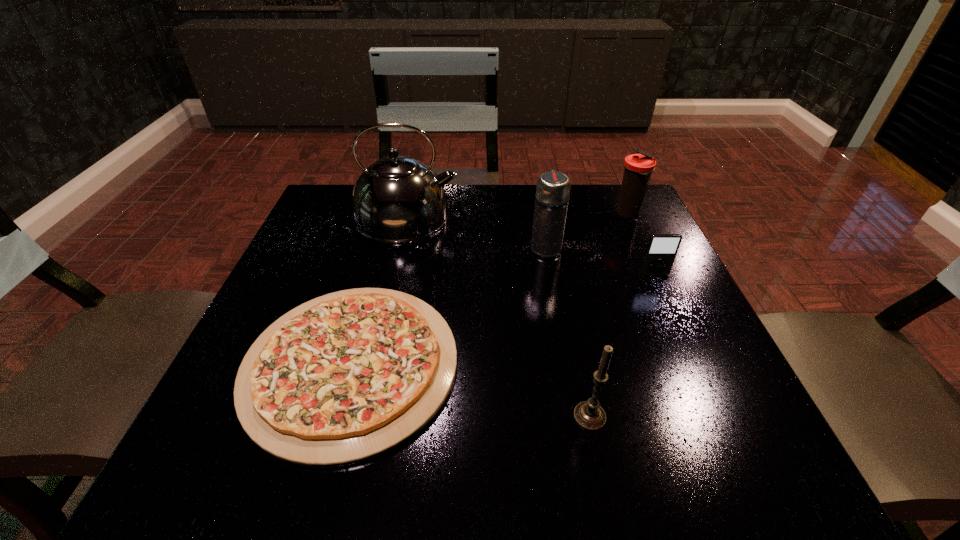
The image size is (960, 540). Identify the location of kettle. (397, 199).

This screenshot has height=540, width=960. I want to click on the left thermos bottle, so click(553, 188).

This screenshot has height=540, width=960. In order to click on the right thermos bottle in this screenshot , I will do `click(638, 168)`.

Image resolution: width=960 pixels, height=540 pixels. Identify the location of candle. (589, 414).

Locate an element on the screen. Image resolution: width=960 pixels, height=540 pixels. the second shortest object is located at coordinates (661, 250).

The height and width of the screenshot is (540, 960). Find the location of `the fourth farthest object`. the fourth farthest object is located at coordinates (661, 250).

Locate an element on the screen. The width and height of the screenshot is (960, 540). the shortest object is located at coordinates (348, 376).

Identify the location of vacant space located from the spout of the kettle. Image resolution: width=960 pixels, height=540 pixels. (606, 215).

Identify the location of vacant area situated 0.090m with a handle on the side of the nearer thermos bottle. Image resolution: width=960 pixels, height=540 pixels. (540, 214).

Find the location of `free spot located with a handle on the side of the nearer thermos bottle`. free spot located with a handle on the side of the nearer thermos bottle is located at coordinates (536, 194).